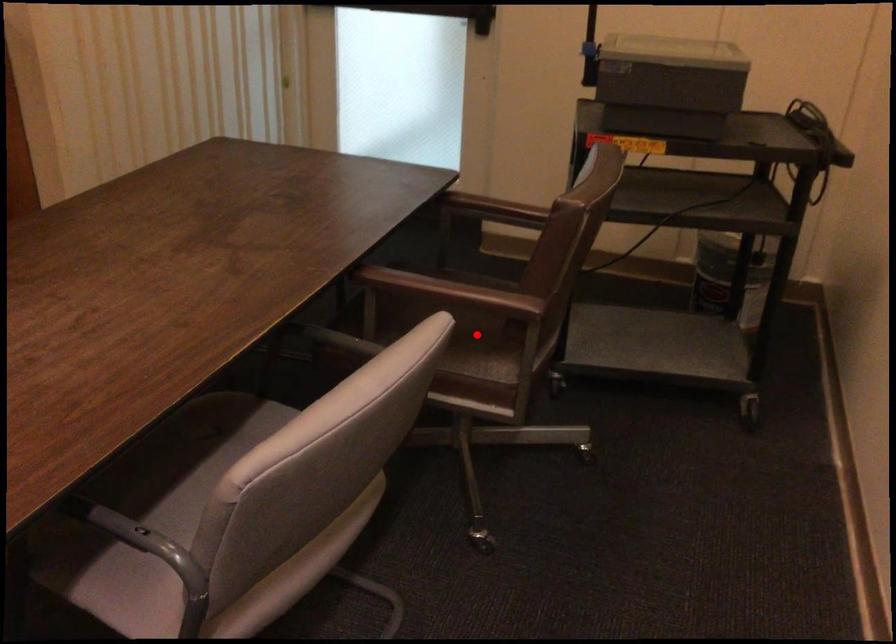
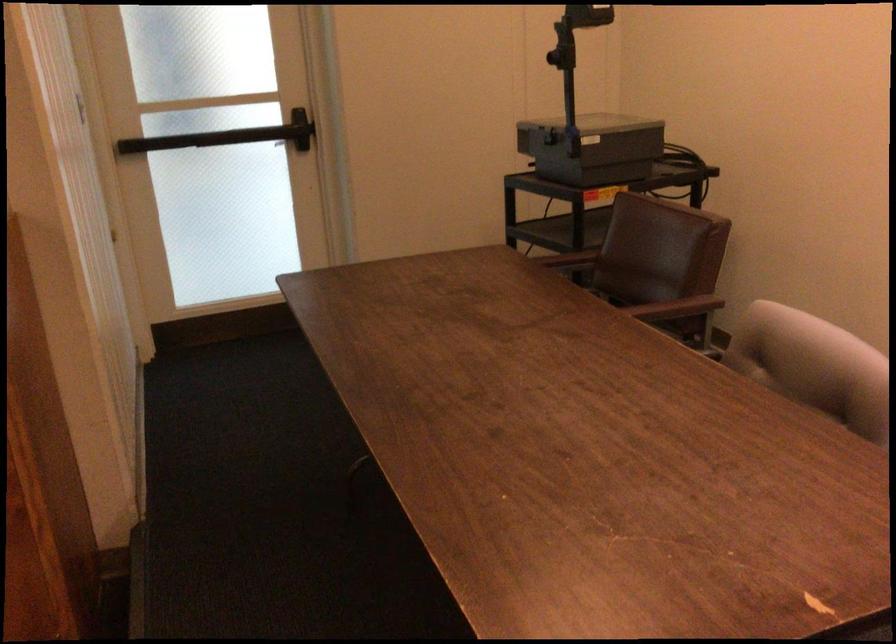
Question: I am providing you with two images of the same scene from different viewpoints. A red point is marked on the first image. At the location where the point appears in image 1, is it still visible in image 2?

Choices:
 (A) Yes
 (B) No

Answer: (B)